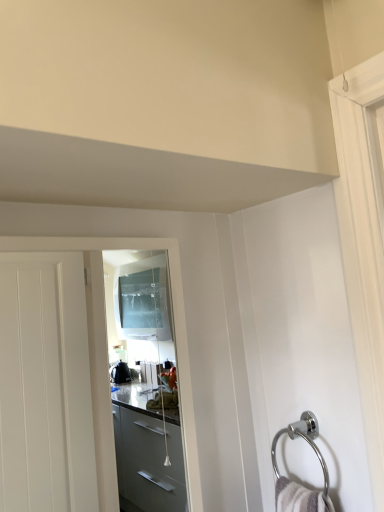
Where is `satin chrome towel ring at lower right`? The width and height of the screenshot is (384, 512). satin chrome towel ring at lower right is located at coordinates (305, 440).

The height and width of the screenshot is (512, 384). What do you see at coordinates (305, 440) in the screenshot? I see `satin chrome towel ring at lower right` at bounding box center [305, 440].

Where is `satin chrome towel ring at lower right`? This screenshot has width=384, height=512. satin chrome towel ring at lower right is located at coordinates coord(305,440).